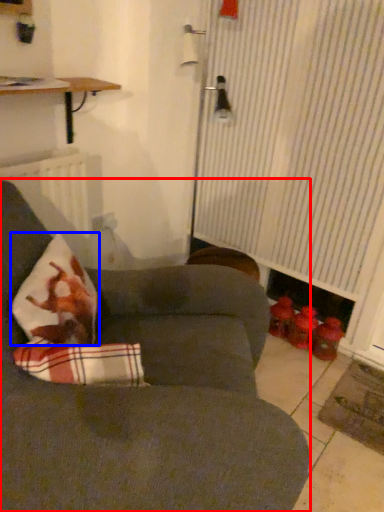
Question: Which of the following is the farthest to the observer, studio couch (highlighted by a red box) or throw pillow (highlighted by a blue box)?

Choices:
 (A) studio couch
 (B) throw pillow

Answer: (B)